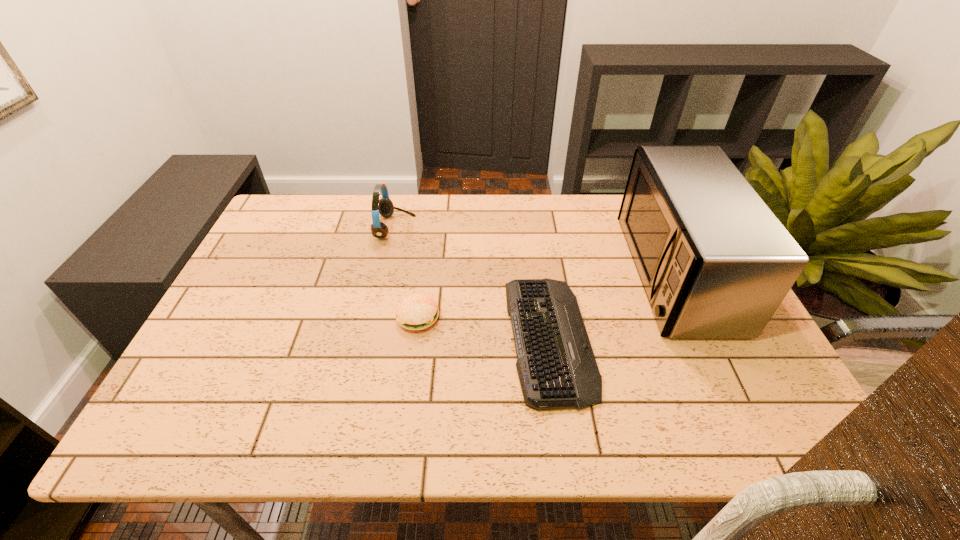
Where is `vacant space that's between the third shortest object and the computer keyboard`? This screenshot has height=540, width=960. vacant space that's between the third shortest object and the computer keyboard is located at coordinates tap(472, 283).

You are a GUI agent. You are given a task and a screenshot of the screen. Output one action in this format:
    pyautogui.click(x=<x>, y=<y>)
    Task: Click on the vacant space that's between the shortest object and the microwave_oven
    This screenshot has width=960, height=540.
    Given the screenshot: What is the action you would take?
    pyautogui.click(x=612, y=305)

I want to click on object that stands as the third closest to the shortest object, so click(x=384, y=206).

Identify which object is the second closest to the shortest object. Please provide its 2D coordinates. Your answer should be formatted as a tuple, i.e. [(x, y)], where the tuple contains the x and y coordinates of a point satisfying the conditions above.

[(417, 311)]

Identify the location of free spot that satisfies the following two spatial constraints: 1. with the microphone attached to the side of the third tallest object; 2. on the left side of the headset. (374, 318).

The width and height of the screenshot is (960, 540). Find the location of `vacant area that satisfies the following two spatial constraints: 1. with the microphone attached to the side of the computer keyboard; 2. on the left side of the second tallest object`. vacant area that satisfies the following two spatial constraints: 1. with the microphone attached to the side of the computer keyboard; 2. on the left side of the second tallest object is located at coordinates (371, 338).

Locate an element on the screen. vacant space that satisfies the following two spatial constraints: 1. with the microphone attached to the side of the headset; 2. on the left side of the patty is located at coordinates (374, 318).

You are a GUI agent. You are given a task and a screenshot of the screen. Output one action in this format:
    pyautogui.click(x=<x>, y=<y>)
    Task: Click on the free space that satisfies the following two spatial constraints: 1. with the microphone attached to the side of the third object from left to right; 2. on the right side of the headset
    
    Given the screenshot: What is the action you would take?
    pyautogui.click(x=371, y=338)

I want to click on free location that satisfies the following two spatial constraints: 1. with the microphone attached to the side of the patty; 2. on the left side of the second tallest object, so click(374, 318).

The width and height of the screenshot is (960, 540). Find the location of `vacant region that satisfies the following two spatial constraints: 1. with the microphone attached to the side of the computer keyboard; 2. on the left side of the third shortest object`. vacant region that satisfies the following two spatial constraints: 1. with the microphone attached to the side of the computer keyboard; 2. on the left side of the third shortest object is located at coordinates (371, 338).